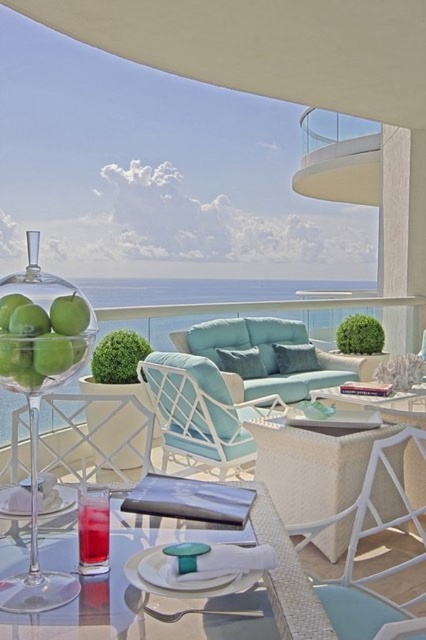
You are planning to place a large potted plant on the balcony. The potted plant is as big as the white glass railing at upper right. Can the teal fabric couch at center accommodate the potted plant in terms of size?

The teal fabric couch at center has a smaller size compared to the white glass railing at upper right. Since the potted plant is as big as the white glass railing at upper right, the teal fabric couch at center may not have enough space to accommodate the potted plant due to its smaller size.

Looking at this image, you are a delivery person trying to place a large potted plant that is 1.5 meters wide between the light blue fabric armchair at center and the white woven armchair at lower right. Can the plant fit in the space between them?

The light blue fabric armchair at center and white woven armchair at lower right are 1.38 meters apart from each other. Since the plant is 1.5 meters wide, it cannot fit in the space between them as the distance is smaller than the plant width.